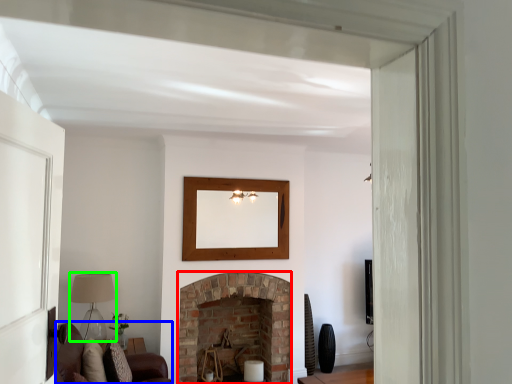
Question: Which is nearer to the fireplace (highlighted by a red box)? couch (highlighted by a blue box) or lamp (highlighted by a green box).

Choices:
 (A) couch
 (B) lamp

Answer: (A)